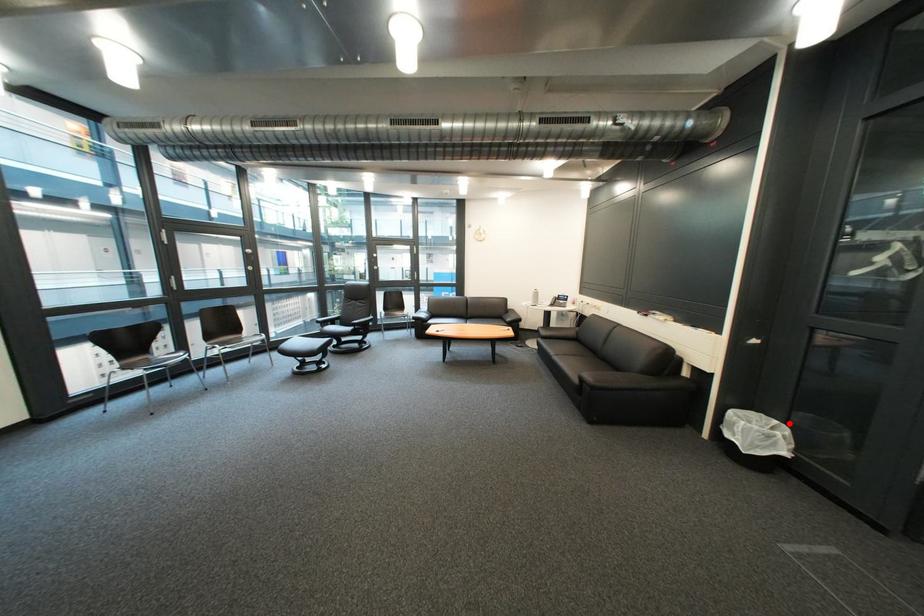
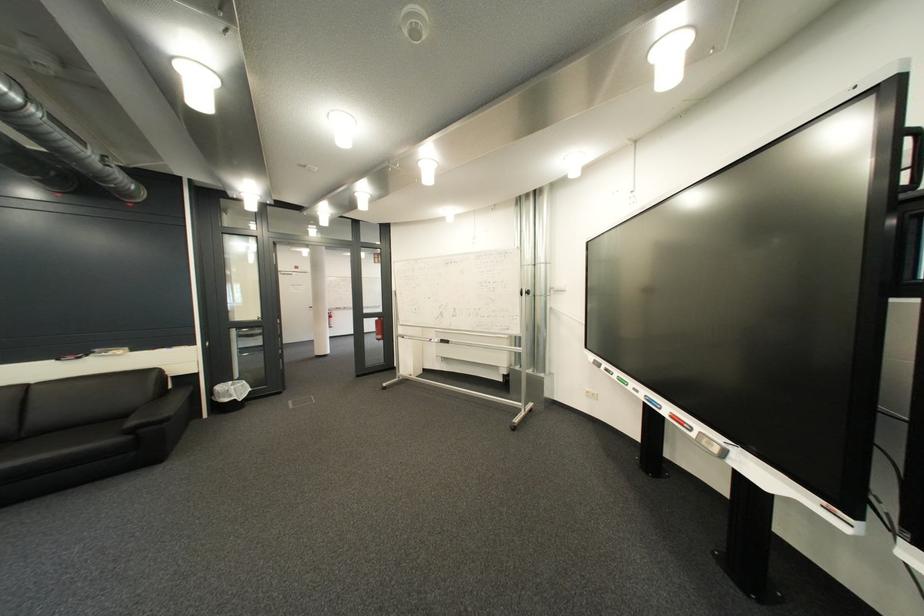
Question: I am providing you with two images of the same scene from different viewpoints. Image1 has a red point marked. In image2, the corresponding 3D location appears at what relative position? Reply with the corresponding letter.

Choices:
 (A) Closer
 (B) Farther

Answer: (A)